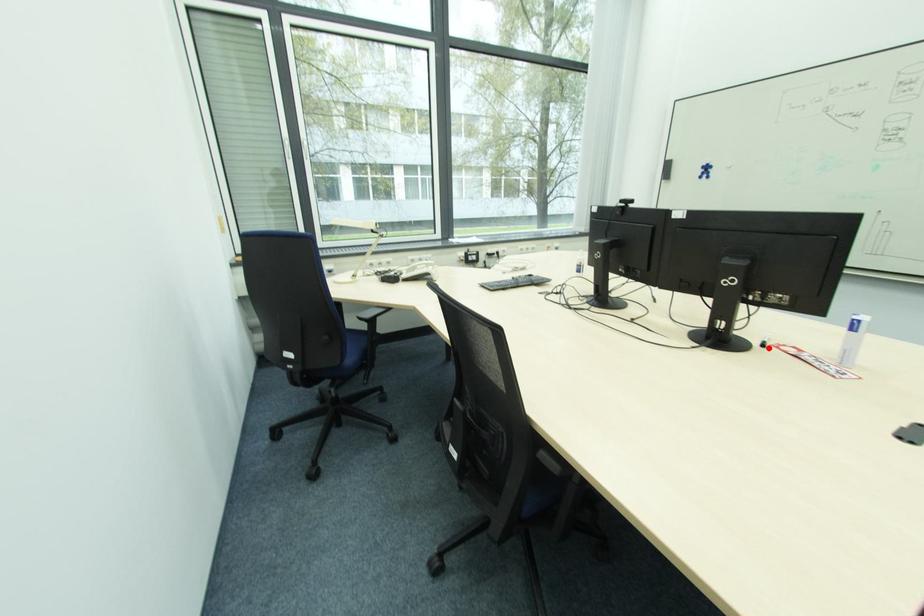
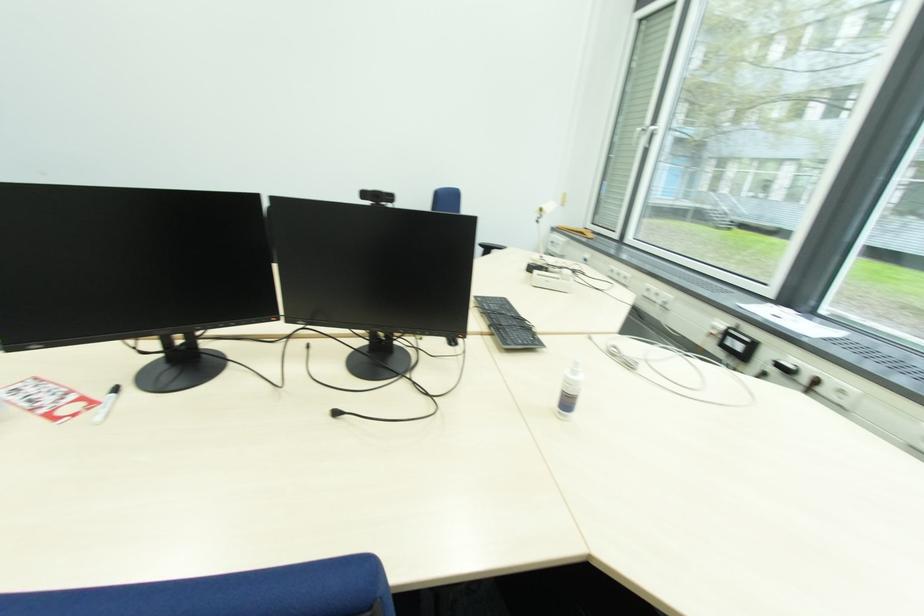
Locate, in the second image, the point that corresponds to the highlighted location in the first image.

(118, 392)